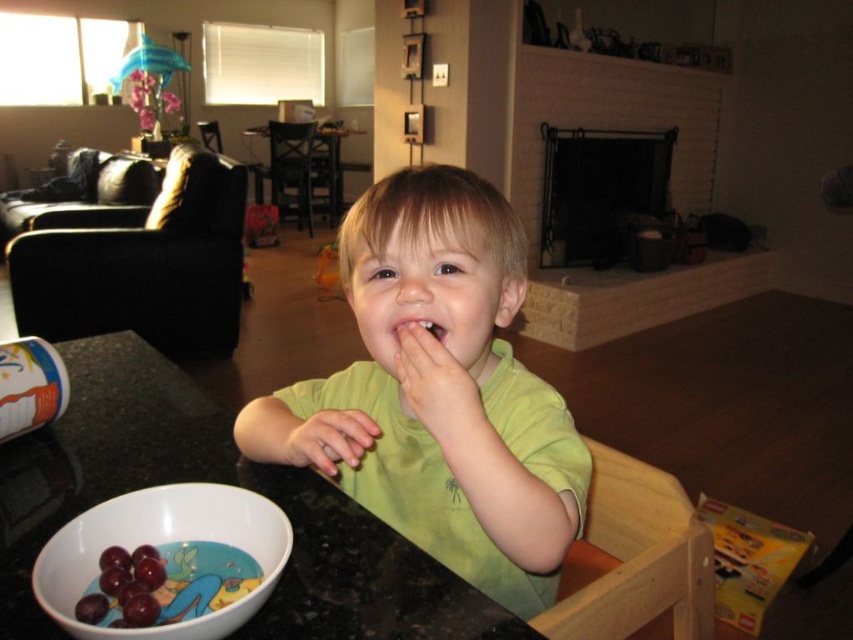
Is black granite table at lower left shorter than black fabric couch at left?

Correct, black granite table at lower left is not as tall as black fabric couch at left.

Image resolution: width=853 pixels, height=640 pixels. Identify the location of black granite table at lower left. (219, 483).

In the scene shown: Who is more forward, (20, 464) or (154, 224)?

Point (20, 464) is in front.

Locate an element on the screen. This screenshot has height=640, width=853. black granite table at lower left is located at coordinates (219, 483).

Is black fabric couch at left to the left of wooden table at center from the viewer's perspective?

In fact, black fabric couch at left is to the right of wooden table at center.

Which is more to the left, black fabric couch at left or wooden table at center?

From the viewer's perspective, wooden table at center appears more on the left side.

Locate an element on the screen. This screenshot has width=853, height=640. black fabric couch at left is located at coordinates (143, 266).

Where is `black fabric couch at left`? Image resolution: width=853 pixels, height=640 pixels. black fabric couch at left is located at coordinates (143, 266).

Which of these two, black fabric couch at left or smooth skin at mouth right, stands taller?

black fabric couch at left is taller.

Is black fabric couch at left thinner than smooth skin at mouth right?

No.

This screenshot has height=640, width=853. In order to click on black fabric couch at left in this screenshot , I will do pos(143,266).

Locate an element on the screen. This screenshot has width=853, height=640. black fabric couch at left is located at coordinates (143, 266).